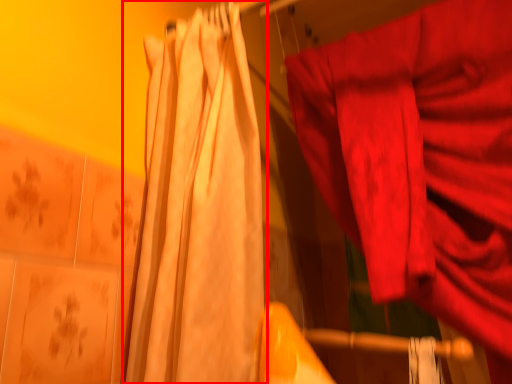
Question: From the image, what is the correct spatial relationship of curtain (annotated by the red box) in relation to curtain?

Choices:
 (A) right
 (B) left

Answer: (B)